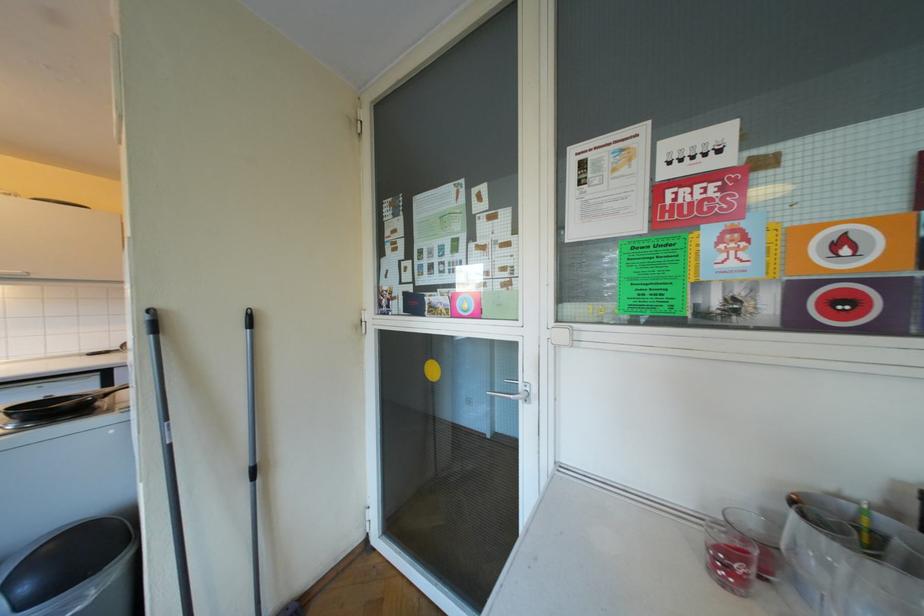
Where is `black pan handle`? black pan handle is located at coordinates (104, 392).